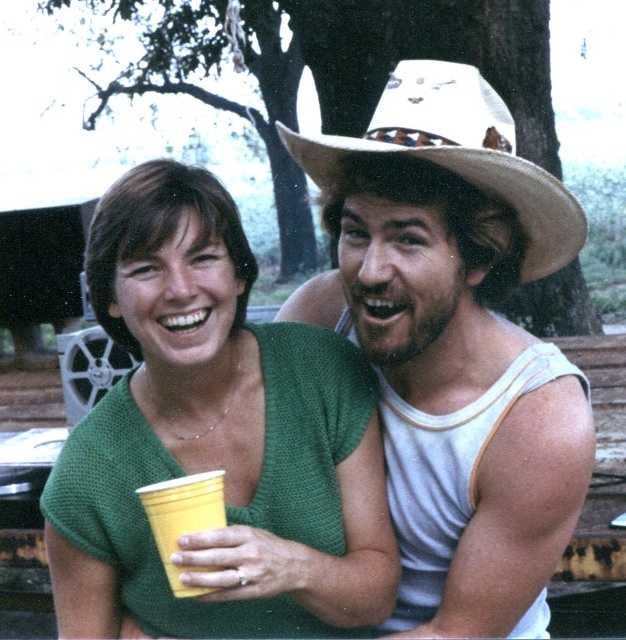
Based on the photo, you are a photographer trying to capture both the green knitted shirt at center and the white straw cowboy hat at upper right in a single frame. Given their sizes, which object will appear bigger in the photo?

The green knitted shirt at center will appear bigger in the photo because it is larger in size than the white straw cowboy hat at upper right.